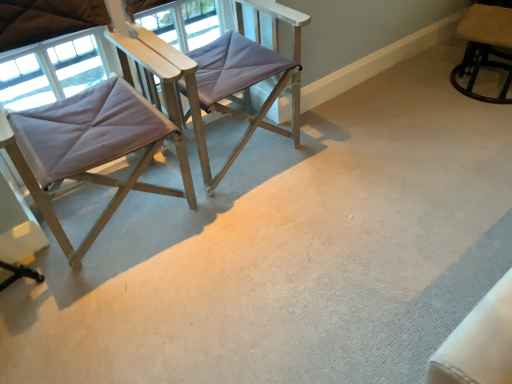
Locate an element on the screen. vacant space in beige fabric chair at upper right, the first chair when ordered from right to left (from a real-world perspective) is located at coordinates (483, 91).